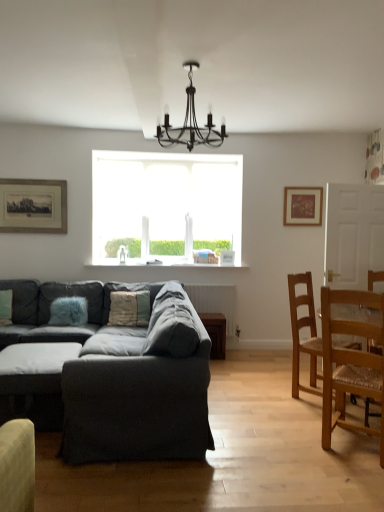
Question: From a real-world perspective, is dark gray fabric ottoman at lower left over textured beige pillow at center, the 2th pillow positioned from the left?

Choices:
 (A) yes
 (B) no

Answer: (B)

Question: Considering the relative sizes of dark gray fabric ottoman at lower left and textured beige pillow at center, arranged as the 1th pillow when viewed from the right, in the image provided, is dark gray fabric ottoman at lower left taller than textured beige pillow at center, arranged as the 1th pillow when viewed from the right,?

Choices:
 (A) yes
 (B) no

Answer: (B)

Question: Is dark gray fabric ottoman at lower left thinner than textured beige pillow at center, arranged as the 1th pillow when viewed from the right?

Choices:
 (A) yes
 (B) no

Answer: (B)

Question: Are dark gray fabric ottoman at lower left and textured beige pillow at center, arranged as the 1th pillow when viewed from the right, beside each other?

Choices:
 (A) yes
 (B) no

Answer: (B)

Question: Does dark gray fabric ottoman at lower left turn towards textured beige pillow at center, arranged as the 1th pillow when viewed from the right?

Choices:
 (A) no
 (B) yes

Answer: (A)

Question: In terms of height, does black metal chandelier at upper center look taller or shorter compared to dark gray fabric ottoman at lower left?

Choices:
 (A) short
 (B) tall

Answer: (B)

Question: Is black metal chandelier at upper center in front of or behind dark gray fabric ottoman at lower left in the image?

Choices:
 (A) front
 (B) behind

Answer: (A)

Question: Is black metal chandelier at upper center bigger or smaller than dark gray fabric ottoman at lower left?

Choices:
 (A) big
 (B) small

Answer: (A)

Question: Is point click(x=187, y=67) positioned closer to the camera than point click(x=13, y=354)?

Choices:
 (A) closer
 (B) farther

Answer: (A)

Question: Looking at their shapes, would you say textured gray couch at center is wider or thinner than light brown wooden chair at right, the 1th chair viewed from the front?

Choices:
 (A) wide
 (B) thin

Answer: (A)

Question: Is point (13, 354) closer or farther from the camera than point (337, 381)?

Choices:
 (A) closer
 (B) farther

Answer: (B)

Question: Is textured gray couch at center to the left or to the right of light brown wooden chair at right, which appears as the second chair when viewed from the back, in the image?

Choices:
 (A) left
 (B) right

Answer: (A)

Question: From a real-world perspective, is textured gray couch at center above or below light brown wooden chair at right, which appears as the second chair when viewed from the back?

Choices:
 (A) below
 (B) above

Answer: (A)

Question: Looking at their shapes, would you say black metal chandelier at upper center is wider or thinner than textured beige pillow at center, the 2th pillow positioned from the left?

Choices:
 (A) thin
 (B) wide

Answer: (B)

Question: Is point (178, 130) closer or farther from the camera than point (117, 318)?

Choices:
 (A) farther
 (B) closer

Answer: (B)